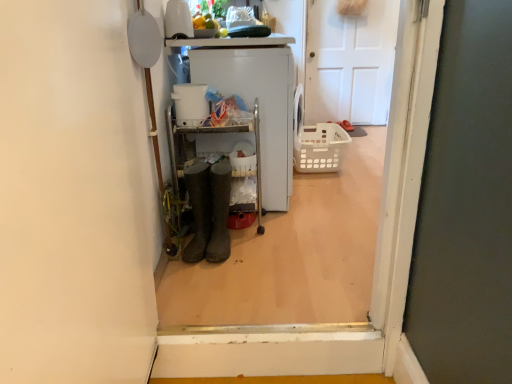
Question: From the image's perspective, is brown rubber boots at center, which appears as the 2th footwear when viewed from the left, below white plastic washing machine at center?

Choices:
 (A) yes
 (B) no

Answer: (A)

Question: Considering the relative sizes of brown rubber boots at center, arranged as the 1th footwear when viewed from the right, and white plastic washing machine at center in the image provided, is brown rubber boots at center, arranged as the 1th footwear when viewed from the right, wider than white plastic washing machine at center?

Choices:
 (A) no
 (B) yes

Answer: (A)

Question: Does brown rubber boots at center, arranged as the 1th footwear when viewed from the right, have a lesser width compared to white plastic washing machine at center?

Choices:
 (A) yes
 (B) no

Answer: (A)

Question: Is brown rubber boots at center, arranged as the 1th footwear when viewed from the right, to the left of white plastic washing machine at center from the viewer's perspective?

Choices:
 (A) no
 (B) yes

Answer: (B)

Question: Are brown rubber boots at center, arranged as the 1th footwear when viewed from the right, and white plastic washing machine at center far apart?

Choices:
 (A) yes
 (B) no

Answer: (B)

Question: Choose the correct answer: Is white matte door at center inside brown rubber boots at center, which appears as the 2th footwear when viewed from the left, or outside it?

Choices:
 (A) inside
 (B) outside

Answer: (B)

Question: Considering the positions of point (373, 11) and point (218, 216), is point (373, 11) closer or farther from the camera than point (218, 216)?

Choices:
 (A) farther
 (B) closer

Answer: (A)

Question: Is white matte door at center in front of or behind brown rubber boots at center, which appears as the 2th footwear when viewed from the left, in the image?

Choices:
 (A) front
 (B) behind

Answer: (B)

Question: From the image's perspective, is white matte door at center above or below brown rubber boots at center, arranged as the 1th footwear when viewed from the right?

Choices:
 (A) below
 (B) above

Answer: (B)

Question: From a real-world perspective, relative to white matte door at center, is brown rubber boots at center, arranged as the 1th footwear when viewed from the right, vertically above or below?

Choices:
 (A) below
 (B) above

Answer: (A)

Question: In terms of width, does brown rubber boots at center, which appears as the 2th footwear when viewed from the left, look wider or thinner when compared to white matte door at center?

Choices:
 (A) wide
 (B) thin

Answer: (A)

Question: From their relative heights in the image, would you say brown rubber boots at center, which appears as the 2th footwear when viewed from the left, is taller or shorter than white matte door at center?

Choices:
 (A) short
 (B) tall

Answer: (A)

Question: Considering the relative positions of brown rubber boots at center, which appears as the 2th footwear when viewed from the left, and white matte door at center in the image provided, is brown rubber boots at center, which appears as the 2th footwear when viewed from the left, to the left or to the right of white matte door at center?

Choices:
 (A) left
 (B) right

Answer: (A)

Question: From the image's perspective, is white matte door at center located above or below brown leather boots at center, arranged as the first footwear when viewed from the left?

Choices:
 (A) above
 (B) below

Answer: (A)

Question: Is white matte door at center taller or shorter than brown leather boots at center, arranged as the first footwear when viewed from the left?

Choices:
 (A) short
 (B) tall

Answer: (B)